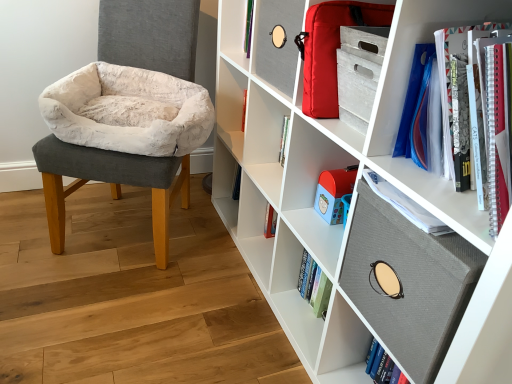
Find the location of a particular element. The width and height of the screenshot is (512, 384). vacant space in front of white plush cushion at left is located at coordinates (115, 314).